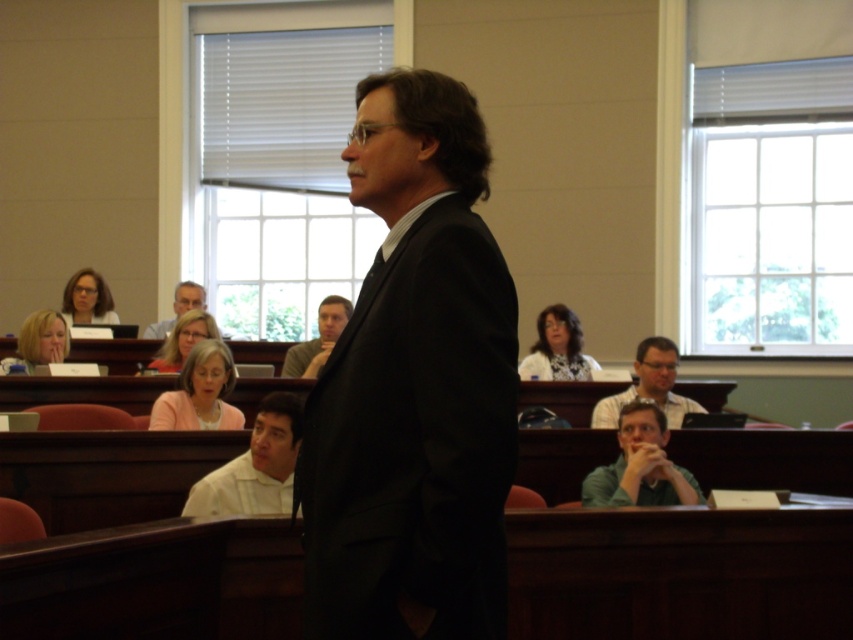
Question: Does green matte shirt at lower center have a larger size compared to matte black suit at center?

Choices:
 (A) yes
 (B) no

Answer: (A)

Question: Does light brown wood chair at lower right appear on the left side of gray fabric shirt at center?

Choices:
 (A) no
 (B) yes

Answer: (A)

Question: Which object is farther from the camera taking this photo?

Choices:
 (A) gray fabric shirt at center
 (B) matte black suit at center
 (C) green matte shirt at lower center

Answer: (B)

Question: Estimate the real-world distances between objects in this image. Which object is farther from the gray fabric shirt at center?

Choices:
 (A) black suit at center
 (B) white shirt at lower center

Answer: (A)

Question: Is white shirt at lower center wider than gray fabric shirt at center?

Choices:
 (A) no
 (B) yes

Answer: (A)

Question: Based on their relative distances, which object is nearer to the light brown wood chair at lower right?

Choices:
 (A) white shirt at lower center
 (B) green matte shirt at lower center
 (C) black suit at center

Answer: (B)